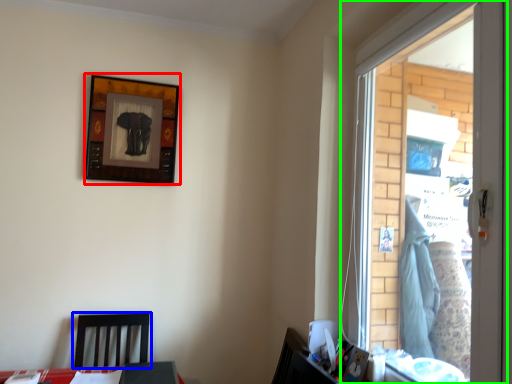
Question: Based on their relative distances, which object is nearer to picture frame (highlighted by a red box)? Choose from furniture (highlighted by a blue box) and window (highlighted by a green box).

Choices:
 (A) furniture
 (B) window

Answer: (A)